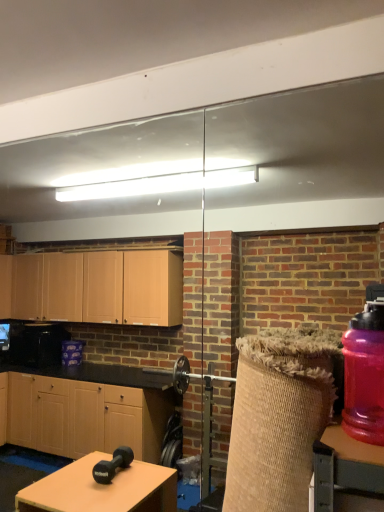
Describe the element at coordinates (365, 372) in the screenshot. I see `purple translucent bottle at right` at that location.

Identify the location of purple translucent bottle at right. Image resolution: width=384 pixels, height=512 pixels. (365, 372).

What is the approximate width of wooden table at center?

The width of wooden table at center is 3.66 inches.

This screenshot has height=512, width=384. Describe the element at coordinates (344, 466) in the screenshot. I see `wooden table at center` at that location.

Find the location of a particular element. The width and height of the screenshot is (384, 512). wooden table at center is located at coordinates (344, 466).

Locate an element on the screen. The image size is (384, 512). purple translucent bottle at right is located at coordinates (365, 372).

Between purple translucent bottle at right and wooden table at center, which one appears on the left side from the viewer's perspective?

wooden table at center.

Which object is further away from the camera taking this photo, purple translucent bottle at right or wooden table at center?

purple translucent bottle at right.

Between point (365, 425) and point (378, 469), which one is positioned in front?

The point (378, 469) is more forward.

From the image's perspective, is purple translucent bottle at right above or below wooden table at center?

purple translucent bottle at right is situated higher than wooden table at center in the image.

From a real-world perspective, is purple translucent bottle at right beneath wooden table at center?

No, from a real-world perspective, purple translucent bottle at right is not under wooden table at center.

Considering the relative sizes of purple translucent bottle at right and wooden table at center in the image provided, is purple translucent bottle at right wider than wooden table at center?

Yes, purple translucent bottle at right is wider than wooden table at center.

Can you confirm if purple translucent bottle at right is shorter than wooden table at center?

No.

Considering the relative sizes of purple translucent bottle at right and wooden table at center in the image provided, is purple translucent bottle at right bigger than wooden table at center?

Yes.

Looking at this image, is purple translucent bottle at right positioned beyond the bounds of wooden table at center?

Indeed, purple translucent bottle at right is completely outside wooden table at center.

Is the surface of purple translucent bottle at right in direct contact with wooden table at center?

No, purple translucent bottle at right is not beside wooden table at center.

Is purple translucent bottle at right oriented towards wooden table at center?

No, purple translucent bottle at right does not turn towards wooden table at center.

You are a GUI agent. You are given a task and a screenshot of the screen. Output one action in this format:
    pyautogui.click(x=<x>, y=<y>)
    Task: Click on the table below the purple translucent bottle at right (from the image's perspective)
    The height and width of the screenshot is (512, 384).
    Given the screenshot: What is the action you would take?
    pyautogui.click(x=344, y=466)

Considering the relative positions of wooden table at center and purple translucent bottle at right in the image provided, is wooden table at center to the right of purple translucent bottle at right from the viewer's perspective?

In fact, wooden table at center is to the left of purple translucent bottle at right.

Which object is further away from the camera taking this photo, wooden table at center or purple translucent bottle at right?

purple translucent bottle at right is further from the camera.

Considering the points (327, 458) and (353, 408), which point is in front, point (327, 458) or point (353, 408)?

Positioned in front is point (327, 458).

From the image's perspective, relative to purple translucent bottle at right, is wooden table at center above or below?

Based on their image positions, wooden table at center is located beneath purple translucent bottle at right.

From a real-world perspective, is wooden table at center located higher than purple translucent bottle at right?

No, from a real-world perspective, wooden table at center is not on top of purple translucent bottle at right.

Considering the sizes of wooden table at center and purple translucent bottle at right in the image, is wooden table at center wider or thinner than purple translucent bottle at right?

Considering their sizes, wooden table at center looks slimmer than purple translucent bottle at right.

Between wooden table at center and purple translucent bottle at right, which one has less height?

wooden table at center is shorter.

Which of these two, wooden table at center or purple translucent bottle at right, is bigger?

Bigger between the two is purple translucent bottle at right.

Is wooden table at center spatially inside purple translucent bottle at right, or outside of it?

wooden table at center is outside purple translucent bottle at right.

Is there a large distance between wooden table at center and purple translucent bottle at right?

wooden table at center is actually quite close to purple translucent bottle at right.

Is wooden table at center looking in the opposite direction of purple translucent bottle at right?

wooden table at center is not turned away from purple translucent bottle at right.

How different are the orientations of wooden table at center and purple translucent bottle at right in degrees?

3.09 degrees.

How distant is wooden table at center from purple translucent bottle at right?

A distance of 4.81 inches exists between wooden table at center and purple translucent bottle at right.

Locate an element on the screen. table to the left of purple translucent bottle at right is located at coordinates (344, 466).

This screenshot has width=384, height=512. I want to click on bottle above the wooden table at center (from a real-world perspective), so click(365, 372).

Where is `bottle behind the wooden table at center`? This screenshot has height=512, width=384. bottle behind the wooden table at center is located at coordinates click(x=365, y=372).